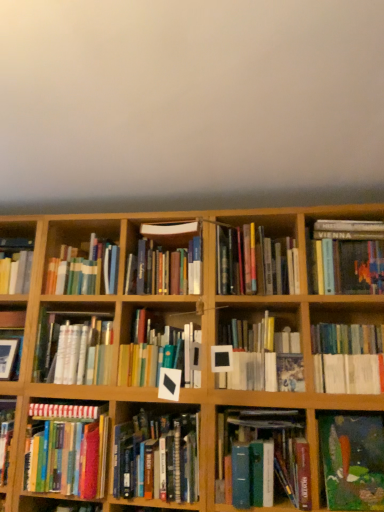
Question: Is hardcover book at upper right, the first book in the right-to-left sequence, aimed at hardcover books at center, the 6th book when ordered from right to left?

Choices:
 (A) yes
 (B) no

Answer: (B)

Question: From the image's perspective, is hardcover book at upper right, the 13th book from the left, on top of hardcover books at center, the 6th book when ordered from right to left?

Choices:
 (A) yes
 (B) no

Answer: (A)

Question: Is the surface of hardcover book at upper right, the 13th book from the left, in direct contact with hardcover books at center, the 8th book positioned from the left?

Choices:
 (A) yes
 (B) no

Answer: (B)

Question: Can you confirm if hardcover book at upper right, the 13th book from the left, is positioned to the right of hardcover books at center, the 8th book positioned from the left?

Choices:
 (A) no
 (B) yes

Answer: (B)

Question: From a real-world perspective, is hardcover book at upper right, the 13th book from the left, on top of hardcover books at center, the 8th book positioned from the left?

Choices:
 (A) yes
 (B) no

Answer: (A)

Question: Relative to oil painting at lower right, which is the third book in right-to-left order, is hardcover books at center, which ranks as the fourth book in right-to-left order, in front or behind?

Choices:
 (A) behind
 (B) front

Answer: (A)

Question: From the image's perspective, is hardcover books at center, which ranks as the fourth book in right-to-left order, located above or below oil painting at lower right, which is the third book in right-to-left order?

Choices:
 (A) below
 (B) above

Answer: (B)

Question: From a real-world perspective, is hardcover books at center, which is the tenth book from left to right, above or below oil painting at lower right, the 11th book in the left-to-right sequence?

Choices:
 (A) above
 (B) below

Answer: (A)

Question: Based on their sizes in the image, would you say hardcover books at center, which ranks as the fourth book in right-to-left order, is bigger or smaller than oil painting at lower right, which is the third book in right-to-left order?

Choices:
 (A) big
 (B) small

Answer: (A)

Question: Considering the positions of hardcover book at center-left, which is the eleventh book in right-to-left order, and white matte book at center, arranged as the fifth book when viewed from the right, in the image, is hardcover book at center-left, which is the eleventh book in right-to-left order, taller or shorter than white matte book at center, arranged as the fifth book when viewed from the right,?

Choices:
 (A) short
 (B) tall

Answer: (A)

Question: In terms of size, does hardcover book at center-left, the third book from the left, appear bigger or smaller than white matte book at center, the ninth book viewed from the left?

Choices:
 (A) small
 (B) big

Answer: (A)

Question: Is hardcover book at center-left, the third book from the left, in front of or behind white matte book at center, the ninth book viewed from the left, in the image?

Choices:
 (A) front
 (B) behind

Answer: (B)

Question: Looking at their shapes, would you say hardcover book at center-left, which is the eleventh book in right-to-left order, is wider or thinner than white matte book at center, arranged as the fifth book when viewed from the right?

Choices:
 (A) wide
 (B) thin

Answer: (A)

Question: From the image's perspective, is hardcover books at center, the 6th book when ordered from right to left, located above or below hardcover books at center right, the 12th book positioned from the left?

Choices:
 (A) above
 (B) below

Answer: (B)

Question: In terms of height, does hardcover books at center, the 8th book positioned from the left, look taller or shorter compared to hardcover books at center right, the 12th book positioned from the left?

Choices:
 (A) short
 (B) tall

Answer: (A)